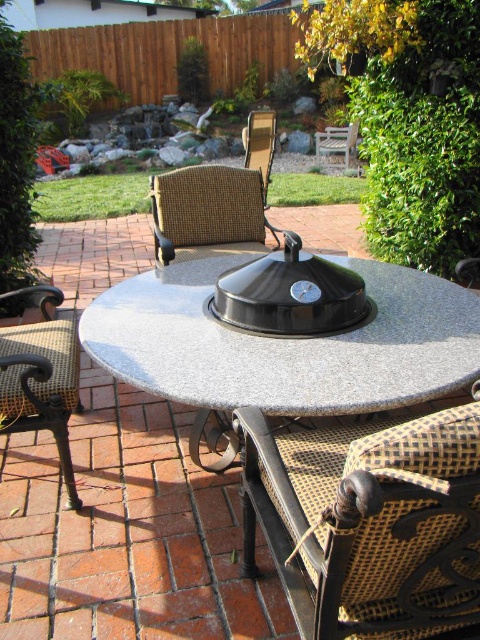
You are standing at the edge of the patio and want to place a new potted plant exactly at the coordinates point [285,346]. According to the scene description, where will the potted plant be placed?

The point [285,346] corresponds to the granite table at center, so placing the potted plant there would put it directly on top of the granite table at center.